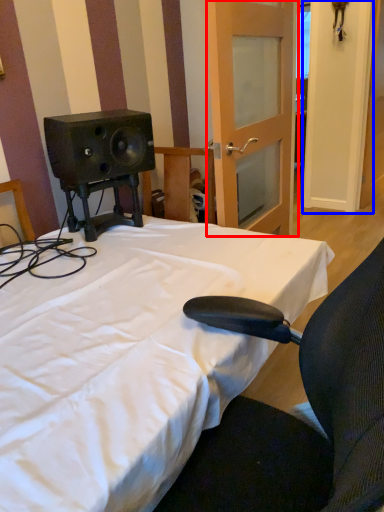
Question: Which point is closer to the camera, door (highlighted by a red box) or door (highlighted by a blue box)?

Choices:
 (A) door
 (B) door

Answer: (A)